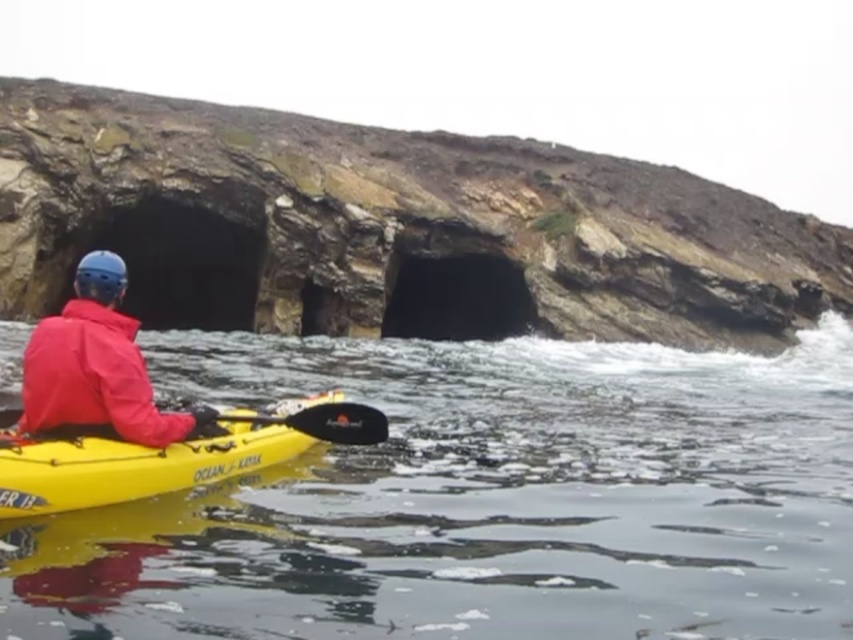
You are navigating a kayak in the image and need to decide whether to adjust your position based on two points marked on your map. The points are labeled as point 1 at coordinates point (x=500, y=429) and point 2 at point (x=45, y=422). Which point is closer to you as you paddle?

Point (x=500, y=429) is further to the viewer than point (x=45, y=422), so point (x=45, y=422) is closer to you as you paddle.

You are a safety inspector checking the kayaker setup. The matte red jacket at center and the yellow plastic kayak at lower left must be positioned correctly for safety. According to safety guidelines, which object should be higher in the image?

The matte red jacket at center should be higher in the image than the yellow plastic kayak at lower left because the description states that the matte red jacket at center is above the yellow plastic kayak at lower left.

You are a kayaker preparing to paddle through a narrow channel. You see the clear water at lower center and the matte red jacket at center. Which object is wider from your perspective?

The clear water at lower center is wider than the matte red jacket at center.